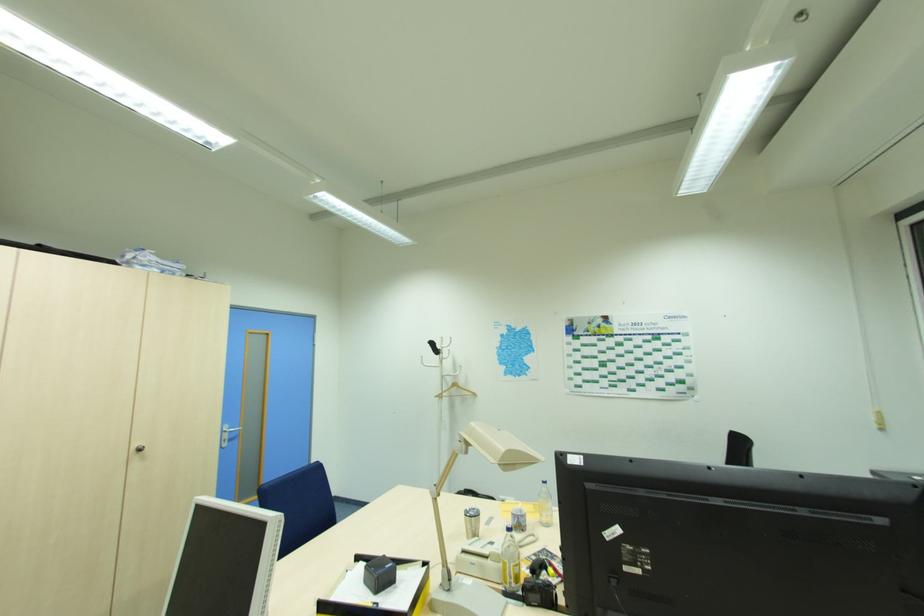
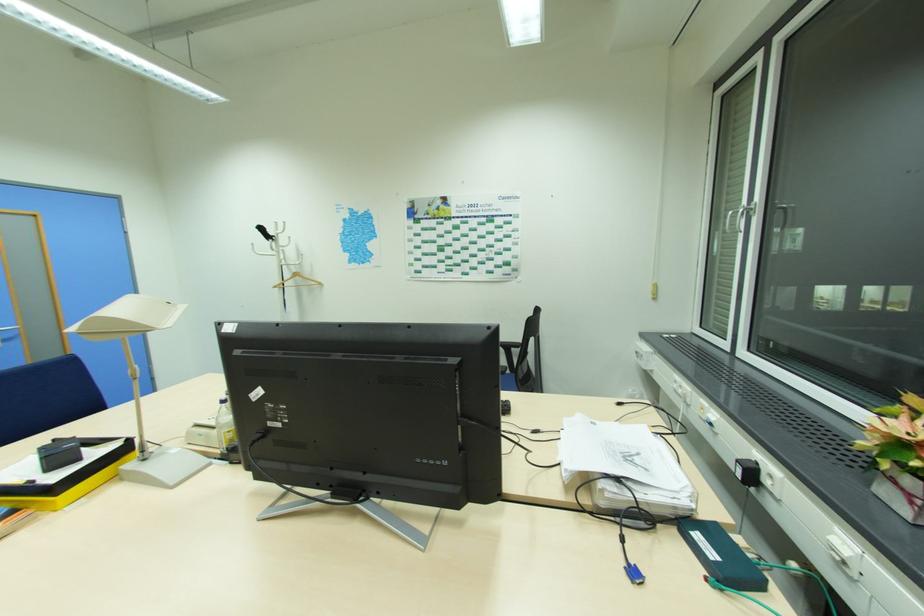
Find the pixel in the second image that matches pixel 235 436 in the first image.

(11, 337)